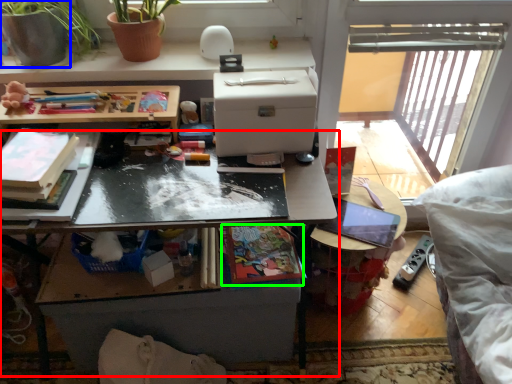
Question: Considering the real-world distances, which object is farthest from table (highlighted by a red box)? flowerpot (highlighted by a blue box) or book (highlighted by a green box)?

Choices:
 (A) flowerpot
 (B) book

Answer: (A)